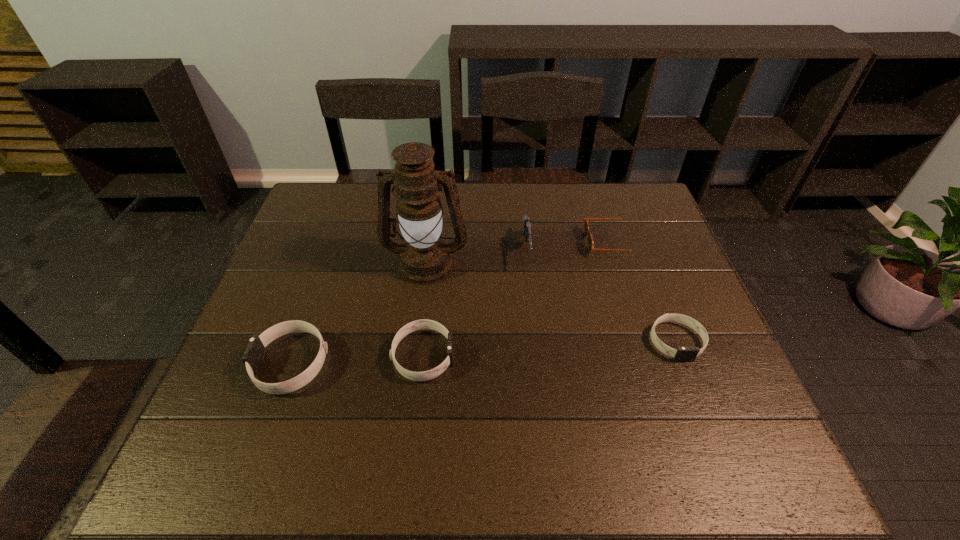
At what (x,y) coordinates should I click in order to perform the action: click on free space at the near edge of the desktop. Please return your answer as a coordinate pair (x, y). The image size is (960, 540). Looking at the image, I should click on (560, 398).

You are a GUI agent. You are given a task and a screenshot of the screen. Output one action in this format:
    pyautogui.click(x=<x>, y=<y>)
    Task: Click on the free space at the left edge
    
    Given the screenshot: What is the action you would take?
    pyautogui.click(x=312, y=235)

Identify the location of vacant space at the right edge of the desktop. This screenshot has height=540, width=960. (677, 250).

This screenshot has width=960, height=540. Identify the location of free spot at the far left corner of the desktop. (342, 215).

This screenshot has height=540, width=960. Find the location of `blank space at the near left corner of the desktop`. blank space at the near left corner of the desktop is located at coordinates (278, 410).

You are a GUI agent. You are given a task and a screenshot of the screen. Output one action in this format:
    pyautogui.click(x=<x>, y=<y>)
    Task: Click on the free point at the near right corner
    The height and width of the screenshot is (540, 960).
    Given the screenshot: What is the action you would take?
    pyautogui.click(x=712, y=422)

At what (x,y) coordinates should I click in order to perform the action: click on free space that is in between the rightmost wristband and the fifth shortest object. Please return your answer as a coordinate pair (x, y). The image size is (960, 540). Looking at the image, I should click on (601, 296).

In order to click on empty space between the leftmost object and the sunglasses in this screenshot , I will do `click(451, 303)`.

Image resolution: width=960 pixels, height=540 pixels. I want to click on free point between the second tallest object and the shortest wristband, so click(601, 296).

Find the location of a particular element. This screenshot has width=960, height=540. unoccupied area between the sunglasses and the gun is located at coordinates (568, 247).